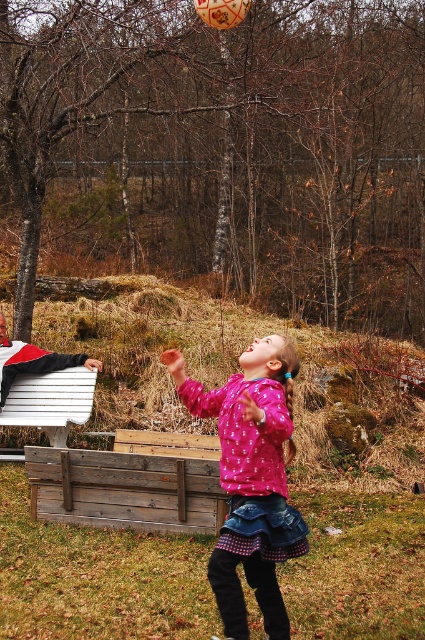
What object is located at the coordinates point [251,477] in the image?

The point [251,477] marks the pink matte sweater at center.